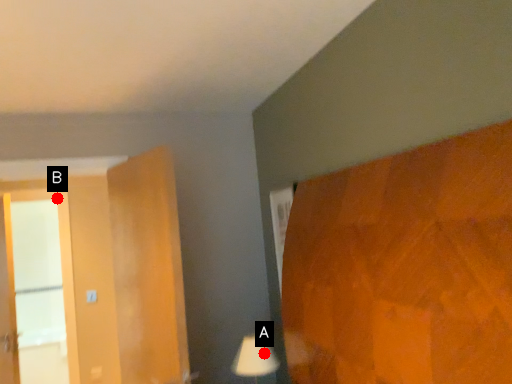
Question: Two points are circled on the image, labeled by A and B beside each circle. Which point is closer to the camera taking this photo?

Choices:
 (A) A is closer
 (B) B is closer

Answer: (A)